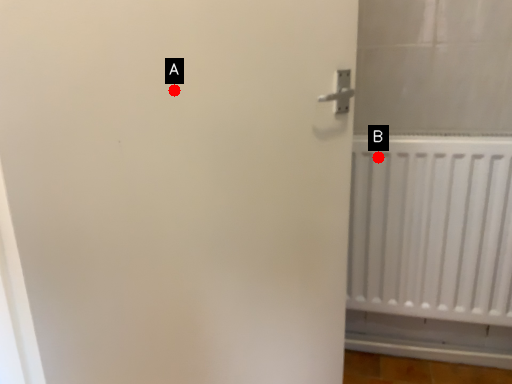
Question: Two points are circled on the image, labeled by A and B beside each circle. Among these points, which one is nearest to the camera?

Choices:
 (A) A is closer
 (B) B is closer

Answer: (A)